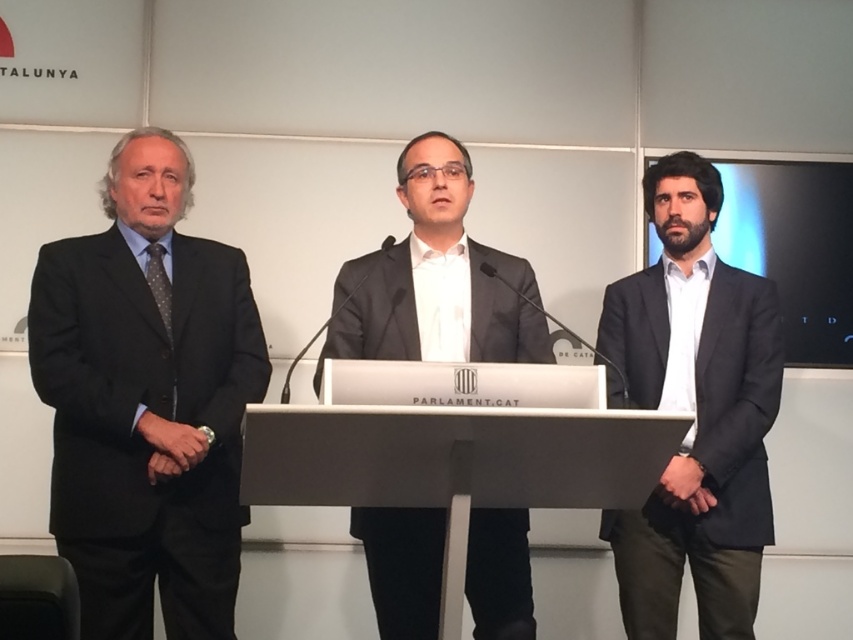
Question: Which of the following is the closest to the observer?

Choices:
 (A) (461, 483)
 (B) (486, 552)
 (C) (666, 259)

Answer: (A)

Question: Does matte black suit at left have a larger size compared to white plastic podium at center?

Choices:
 (A) yes
 (B) no

Answer: (A)

Question: Which is farther from the matte black suit at left?

Choices:
 (A) matte gray suit at center
 (B) white plastic podium at center

Answer: (B)

Question: Is dark gray suit at right smaller than matte gray suit at center?

Choices:
 (A) yes
 (B) no

Answer: (B)

Question: Among these points, which one is nearest to the camera?

Choices:
 (A) (463, 182)
 (B) (317, 412)
 (C) (724, 516)
 (D) (125, 550)

Answer: (B)

Question: Does matte black suit at left have a greater width compared to white plastic podium at center?

Choices:
 (A) yes
 (B) no

Answer: (B)